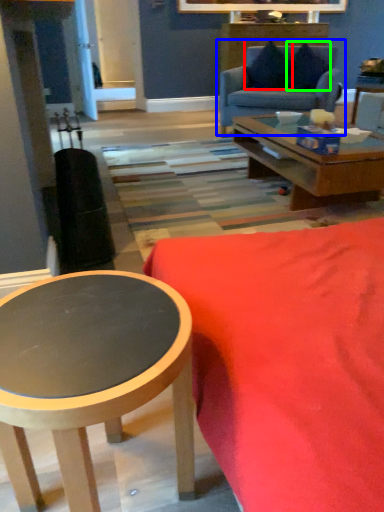
Question: Estimate the real-world distances between objects in this image. Which object is farther from pillow (highlighted by a red box), studio couch (highlighted by a blue box) or pillow (highlighted by a green box)?

Choices:
 (A) studio couch
 (B) pillow

Answer: (A)